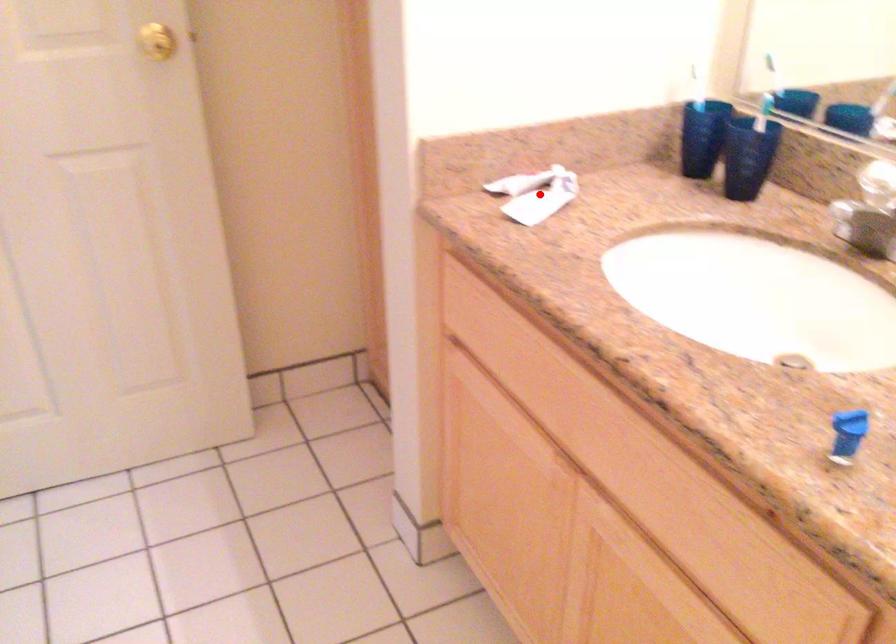
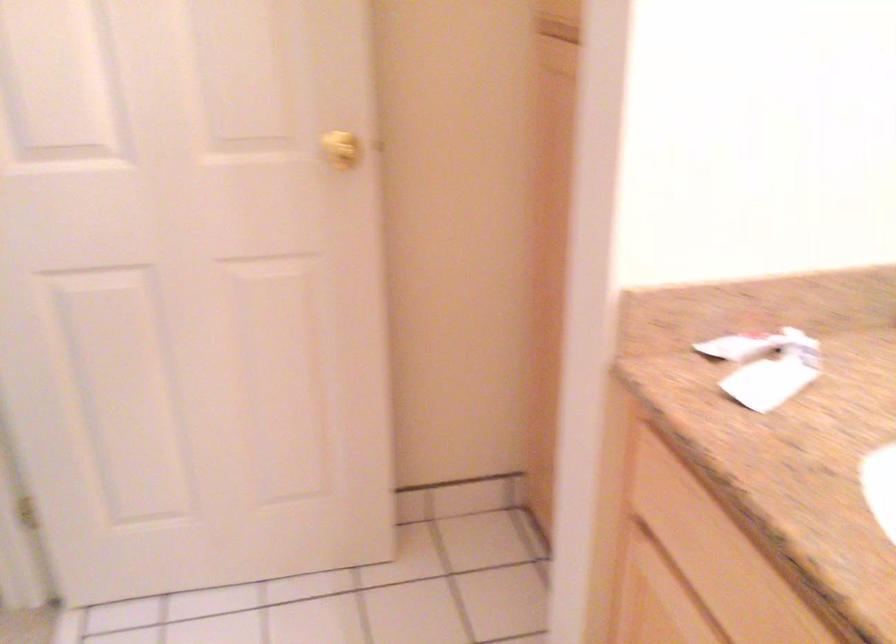
Question: A red point is marked in image1. In image2, is the corresponding 3D point closer to the camera or farther? Reply with the corresponding letter.

Choices:
 (A) The corresponding 3D point is closer.
 (B) The corresponding 3D point is farther.

Answer: (A)